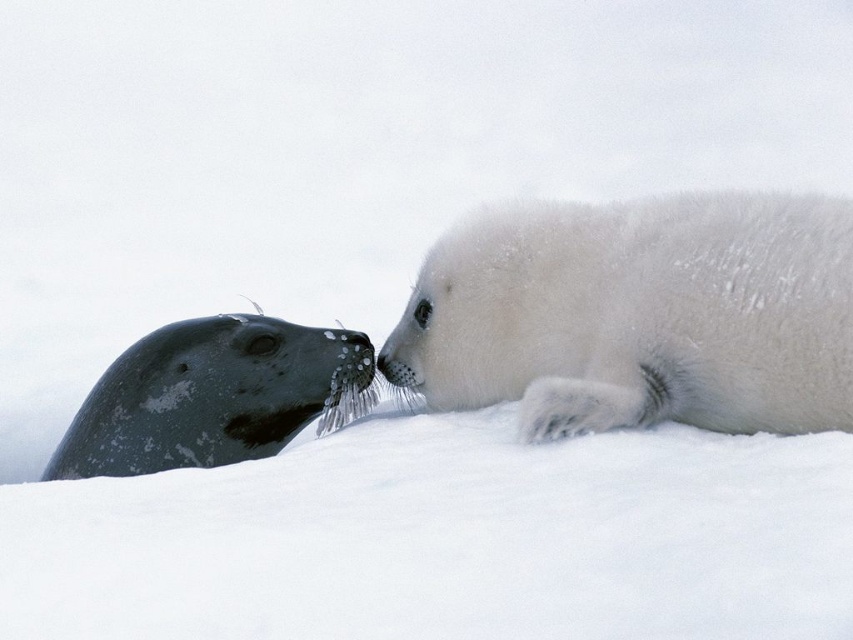
Question: Is white fluffy seal at right smaller than gray textured seal at left?

Choices:
 (A) yes
 (B) no

Answer: (B)

Question: Which of the following is the closest to the observer?

Choices:
 (A) (196, 358)
 (B) (556, 269)

Answer: (B)

Question: Which point is farther from the camera taking this photo?

Choices:
 (A) pyautogui.click(x=759, y=193)
 (B) pyautogui.click(x=285, y=444)

Answer: (B)

Question: Observing the image, what is the correct spatial positioning of white fluffy seal at right in reference to gray textured seal at left?

Choices:
 (A) left
 (B) right

Answer: (B)

Question: Can you confirm if white fluffy seal at right is bigger than gray textured seal at left?

Choices:
 (A) no
 (B) yes

Answer: (B)